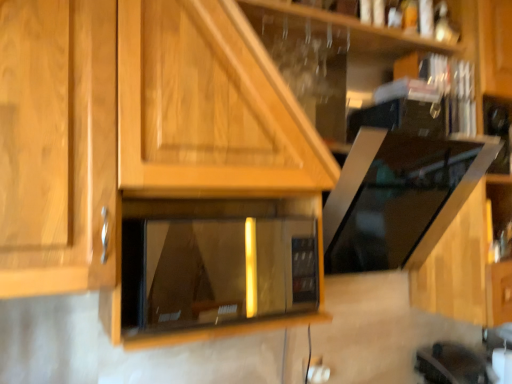
Question: Is the depth of white plastic electric outlet at lower center greater than that of matte black microwave at center?

Choices:
 (A) yes
 (B) no

Answer: (A)

Question: Does white plastic electric outlet at lower center lie in front of matte black microwave at center?

Choices:
 (A) yes
 (B) no

Answer: (B)

Question: Considering the relative sizes of white plastic electric outlet at lower center and matte black microwave at center in the image provided, is white plastic electric outlet at lower center taller than matte black microwave at center?

Choices:
 (A) no
 (B) yes

Answer: (A)

Question: Is matte black microwave at center surrounded by white plastic electric outlet at lower center?

Choices:
 (A) yes
 (B) no

Answer: (B)

Question: Considering the relative positions of white plastic electric outlet at lower center and matte black microwave at center in the image provided, is white plastic electric outlet at lower center to the right of matte black microwave at center from the viewer's perspective?

Choices:
 (A) yes
 (B) no

Answer: (A)

Question: Can you confirm if white plastic electric outlet at lower center is wider than matte black microwave at center?

Choices:
 (A) no
 (B) yes

Answer: (A)

Question: Is wooden at upper center to the right of white plastic electric outlet at lower center from the viewer's perspective?

Choices:
 (A) no
 (B) yes

Answer: (B)

Question: Can you confirm if wooden at upper center is taller than white plastic electric outlet at lower center?

Choices:
 (A) no
 (B) yes

Answer: (B)

Question: Does wooden at upper center have a lesser width compared to white plastic electric outlet at lower center?

Choices:
 (A) no
 (B) yes

Answer: (A)

Question: Is wooden at upper center touching white plastic electric outlet at lower center?

Choices:
 (A) no
 (B) yes

Answer: (A)

Question: Can you confirm if wooden at upper center is bigger than white plastic electric outlet at lower center?

Choices:
 (A) no
 (B) yes

Answer: (B)

Question: Is the depth of wooden at upper center less than that of white plastic electric outlet at lower center?

Choices:
 (A) yes
 (B) no

Answer: (A)

Question: Is white plastic electric outlet at lower center shorter than wooden at upper center?

Choices:
 (A) no
 (B) yes

Answer: (B)